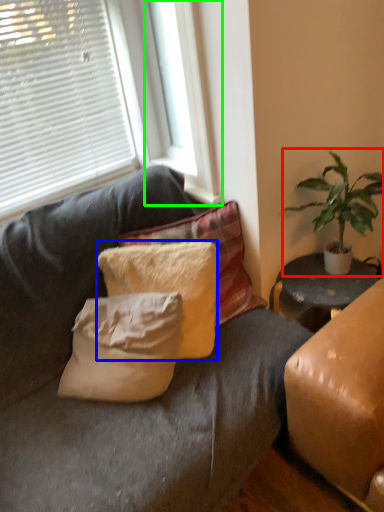
Question: Which is farther away from houseplant (highlighted by a red box)? pillow (highlighted by a blue box) or window frame (highlighted by a green box)?

Choices:
 (A) pillow
 (B) window frame

Answer: (A)